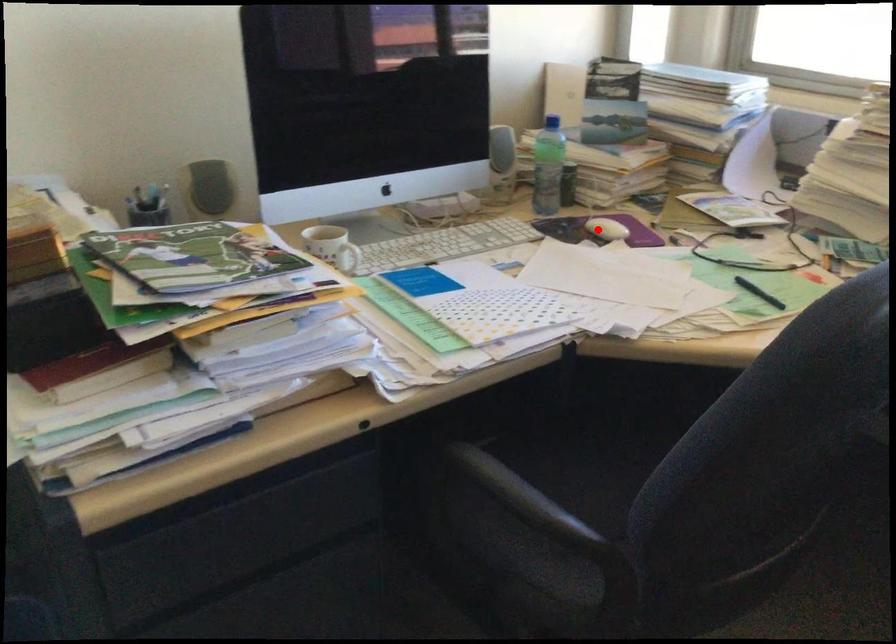
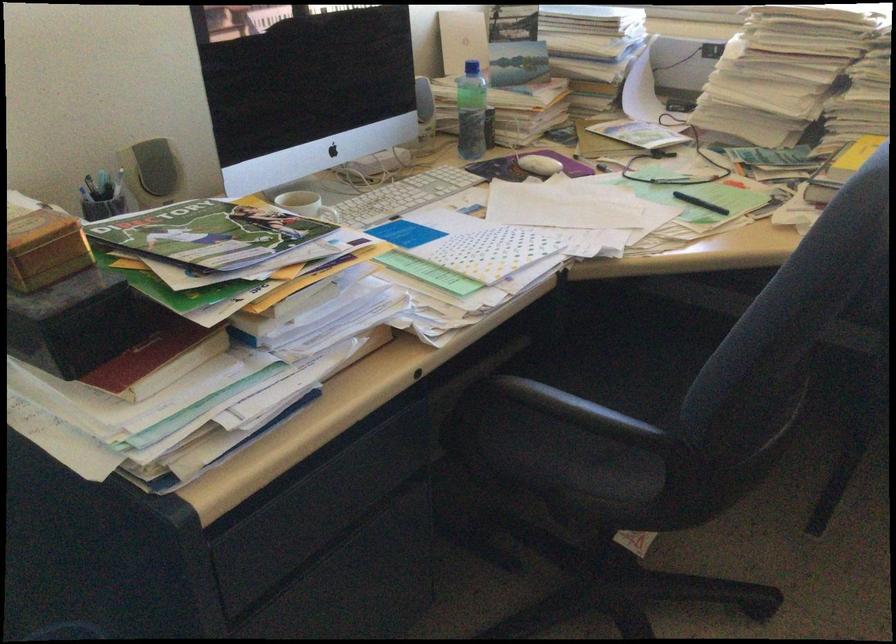
Find the pixel in the second image that matches the highlighted location in the first image.

(538, 165)